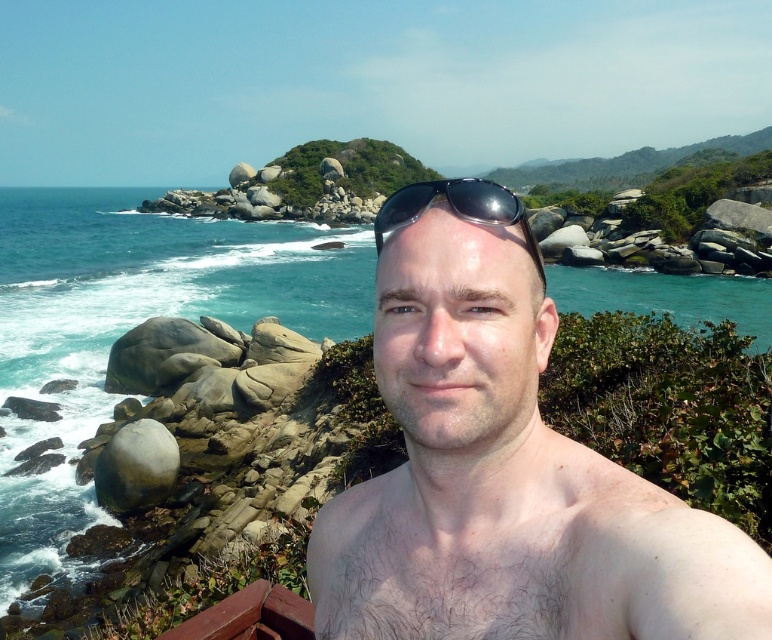
How distant is smooth skin man at center from black shiny sunglasses at center?

smooth skin man at center is 16.90 inches from black shiny sunglasses at center.

Who is lower down, smooth skin man at center or black shiny sunglasses at center?

smooth skin man at center is below.

The width and height of the screenshot is (772, 640). I want to click on smooth skin man at center, so click(503, 467).